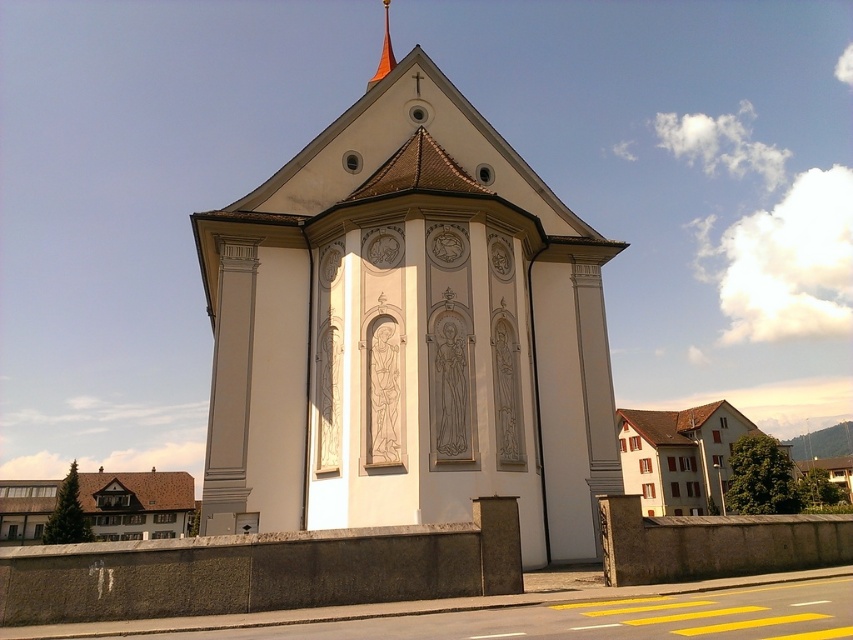
Question: Considering the relative positions of white stone chapel at center and orange glossy spire at upper center in the image provided, where is white stone chapel at center located with respect to orange glossy spire at upper center?

Choices:
 (A) above
 (B) below

Answer: (B)

Question: Among these points, which one is nearest to the camera?

Choices:
 (A) (270, 193)
 (B) (125, 477)
 (C) (375, 77)

Answer: (A)

Question: Among these points, which one is nearest to the camera?

Choices:
 (A) (532, 344)
 (B) (386, 29)
 (C) (173, 500)

Answer: (A)

Question: Which object is closer to the camera taking this photo?

Choices:
 (A) orange glossy spire at upper center
 (B) white stone chapel at center
 (C) brown shingles house at lower left

Answer: (B)

Question: Does brown shingles house at lower left have a larger size compared to orange glossy spire at upper center?

Choices:
 (A) no
 (B) yes

Answer: (A)

Question: In this image, where is white stone chapel at center located relative to brown shingles house at lower left?

Choices:
 (A) left
 (B) right

Answer: (B)